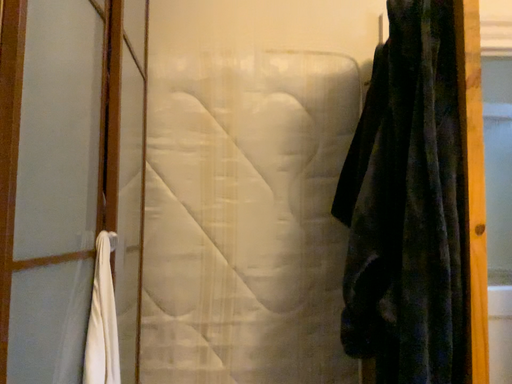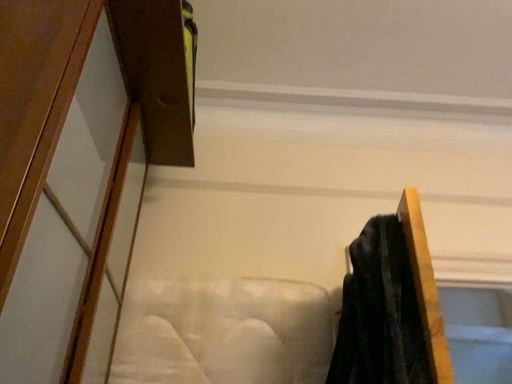
Question: How did the camera likely rotate when shooting the video?

Choices:
 (A) rotated downward
 (B) rotated upward

Answer: (B)